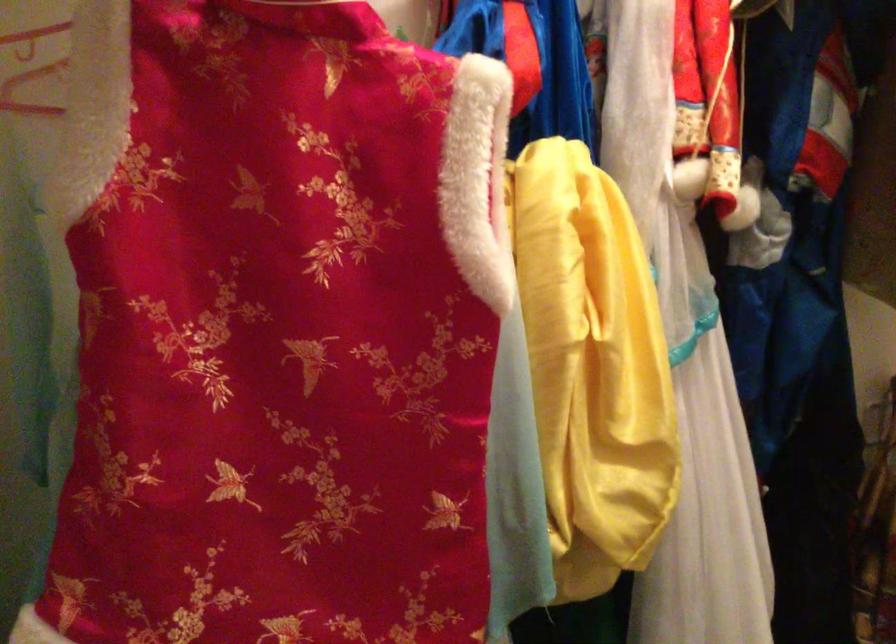
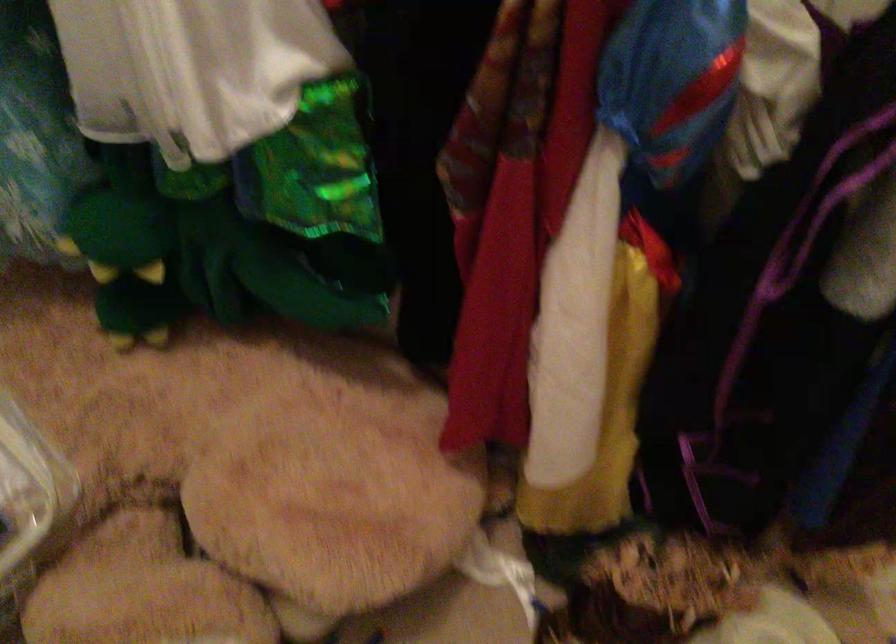
First-person continuous shooting, in which direction is the camera rotating?

The camera's rotation is toward left-down.